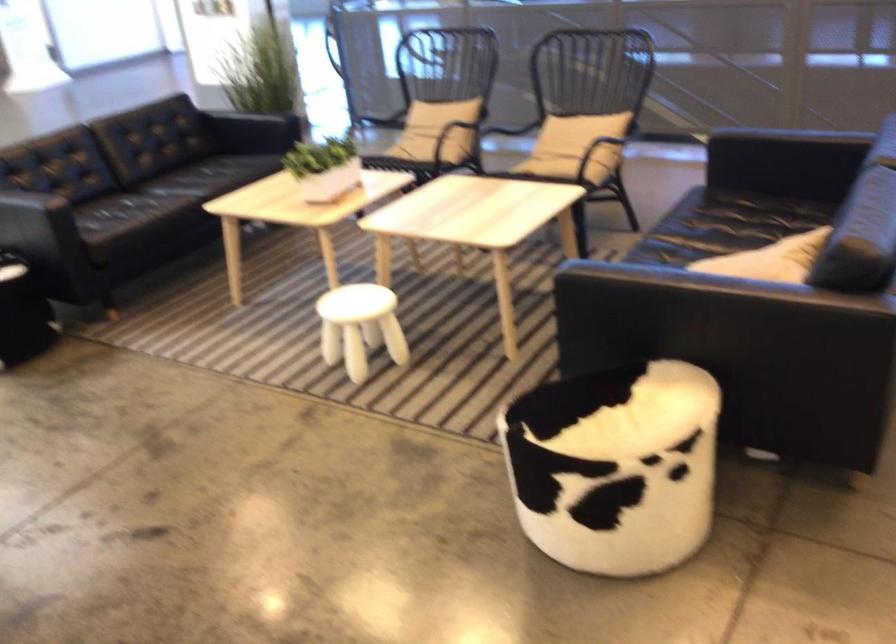
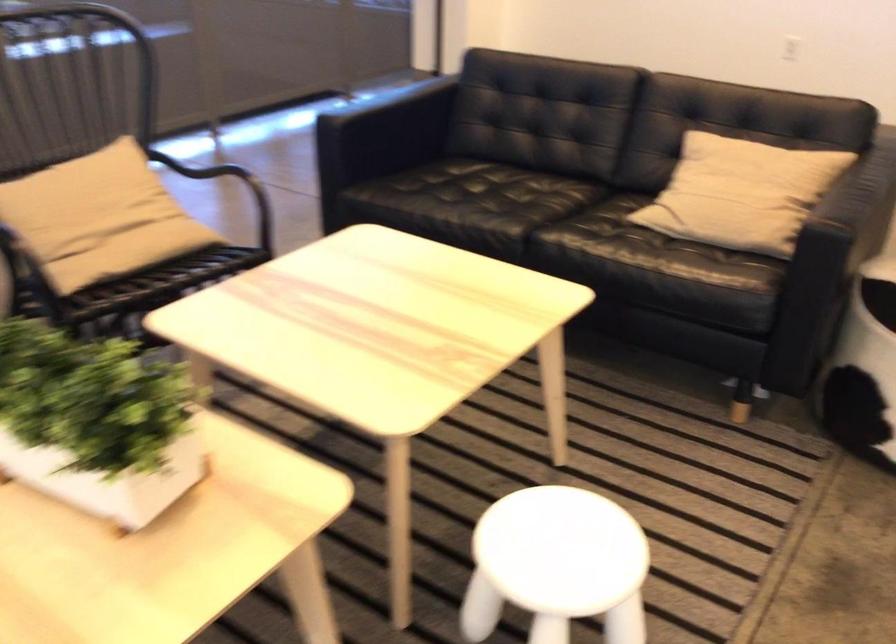
Locate, in the second image, the point that corresponds to point (556, 131) in the first image.

(99, 214)